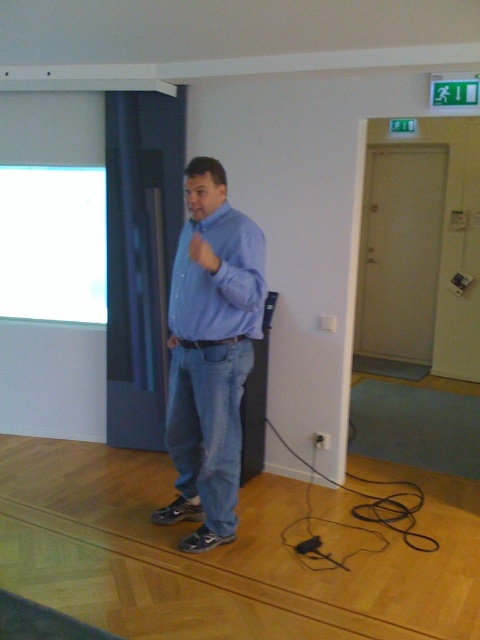
You are an event organizer setting up a stage for a presentation. You have a blue denim jeans at center and a white glossy projection screen at upper left. Which object is narrower in width?

The blue denim jeans at center is thinner than the white glossy projection screen at upper left, so the blue denim jeans at center is narrower in width.

In the scene shown: You are organizing a charity event and need to display clothing items. You have a blue denim jeans at center and a blue cotton shirt at center. Which item would require a larger display space based on their sizes?

The blue denim jeans at center is larger in size than the blue cotton shirt at center, so it would require a larger display space.